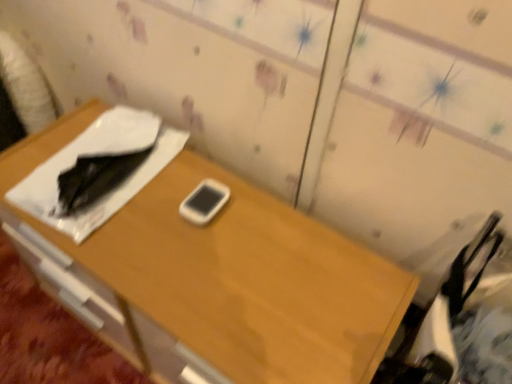
Question: Considering the positions of wooden desk at center and white matte mobile phone at center in the image, is wooden desk at center taller or shorter than white matte mobile phone at center?

Choices:
 (A) short
 (B) tall

Answer: (B)

Question: From the image's perspective, is wooden desk at center located above or below white matte mobile phone at center?

Choices:
 (A) above
 (B) below

Answer: (B)

Question: Visually, is wooden desk at center positioned to the left or to the right of white matte mobile phone at center?

Choices:
 (A) right
 (B) left

Answer: (B)

Question: In the image, is white matte mobile phone at center positioned in front of or behind wooden desk at center?

Choices:
 (A) front
 (B) behind

Answer: (B)

Question: From the image's perspective, is white matte mobile phone at center positioned above or below wooden desk at center?

Choices:
 (A) below
 (B) above

Answer: (B)

Question: Is point (203, 215) positioned closer to the camera than point (309, 292)?

Choices:
 (A) farther
 (B) closer

Answer: (A)

Question: Which is correct: white matte mobile phone at center is inside wooden desk at center, or outside of it?

Choices:
 (A) inside
 (B) outside

Answer: (A)